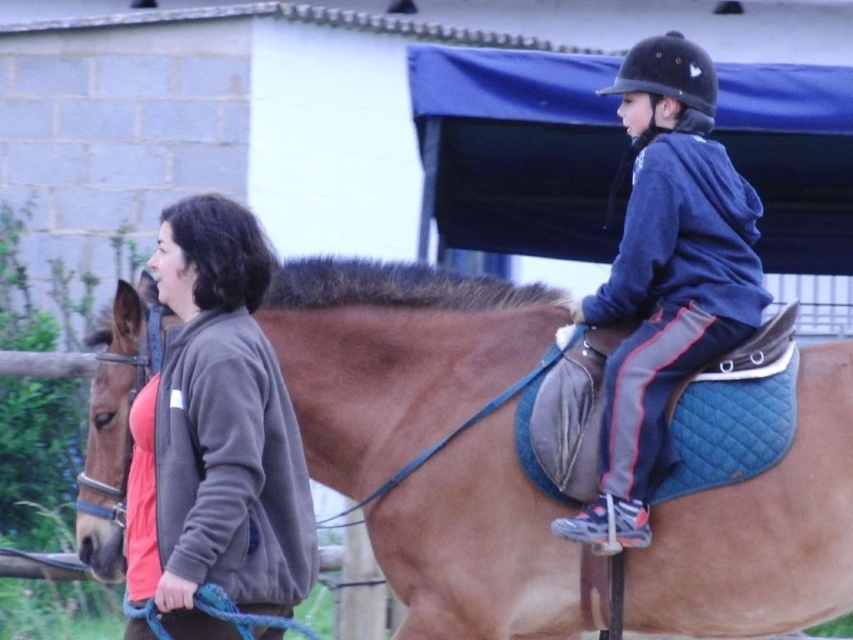
Question: Is brown leather saddle at upper right further to camera compared to blue fleece jacket at upper right?

Choices:
 (A) no
 (B) yes

Answer: (B)

Question: Can you confirm if brown fleece jacket at left is smaller than blue fleece jacket at upper right?

Choices:
 (A) yes
 (B) no

Answer: (A)

Question: Which point is farther to the camera?

Choices:
 (A) (618, 285)
 (B) (244, 577)

Answer: (A)

Question: Does brown fleece jacket at left have a lesser width compared to blue fleece jacket at upper right?

Choices:
 (A) yes
 (B) no

Answer: (A)

Question: Among these objects, which one is nearest to the camera?

Choices:
 (A) blue fleece jacket at upper right
 (B) brown fleece jacket at left

Answer: (B)

Question: Which of these objects is positioned closest to the brown leather saddle at upper right?

Choices:
 (A) brown fleece jacket at left
 (B) blue fleece jacket at upper right

Answer: (B)